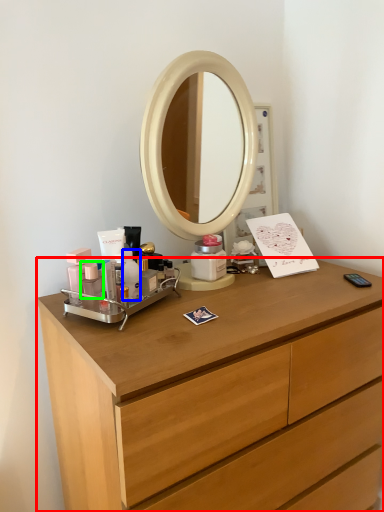
Question: Which object is positioned closest to chest of drawers (highlighted by a red box)? Select from toiletry (highlighted by a blue box) and toiletry (highlighted by a green box).

Choices:
 (A) toiletry
 (B) toiletry

Answer: (A)